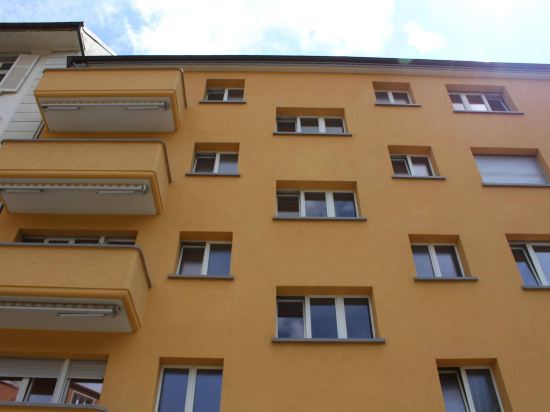
Locate an element on the screen. This screenshot has width=550, height=412. boarded up window is located at coordinates (503, 167).